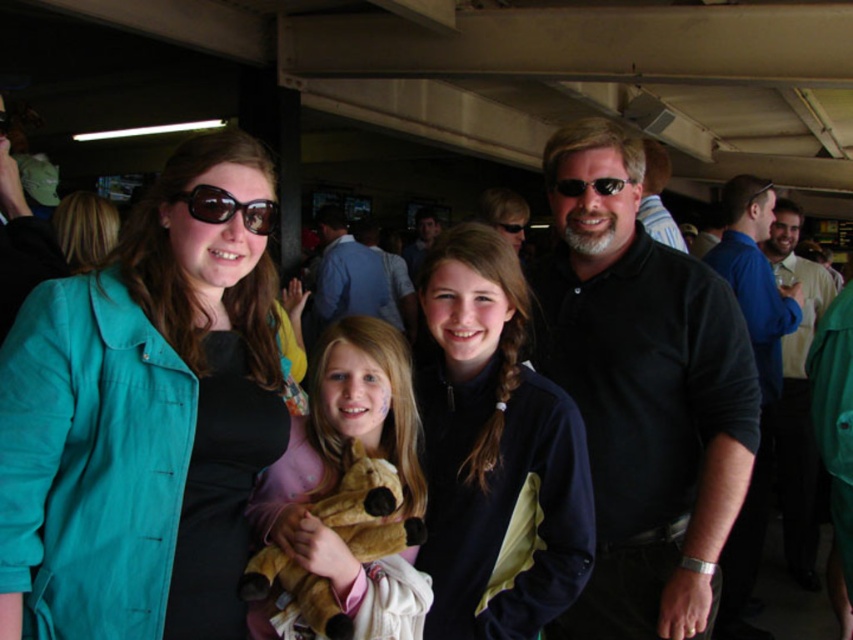
Is blue shirt at right bigger than blue shirt at center?

Correct, blue shirt at right is larger in size than blue shirt at center.

Does blue shirt at right appear on the left side of blue shirt at center?

No, blue shirt at right is not to the left of blue shirt at center.

The image size is (853, 640). Describe the element at coordinates (796, 396) in the screenshot. I see `blue shirt at right` at that location.

The height and width of the screenshot is (640, 853). I want to click on blue shirt at right, so click(x=796, y=396).

Based on the photo, can you confirm if navy blue fleece at center is smaller than matte black sunglasses at upper left?

Incorrect, navy blue fleece at center is not smaller in size than matte black sunglasses at upper left.

How distant is navy blue fleece at center from matte black sunglasses at upper left?

navy blue fleece at center is 57.64 centimeters from matte black sunglasses at upper left.

Where is `navy blue fleece at center`? Image resolution: width=853 pixels, height=640 pixels. navy blue fleece at center is located at coordinates (494, 452).

Can you confirm if soft pink plush at center is positioned below matte black sunglasses at upper left?

Yes, soft pink plush at center is below matte black sunglasses at upper left.

The height and width of the screenshot is (640, 853). Identify the location of soft pink plush at center. (341, 472).

Who is more distant from viewer, (331, 384) or (173, 196)?

Positioned behind is point (331, 384).

I want to click on soft pink plush at center, so click(341, 472).